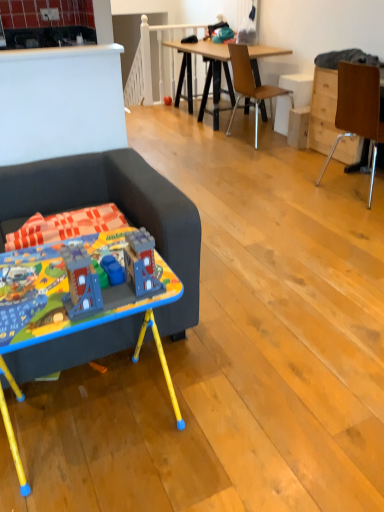
You are a GUI agent. You are given a task and a screenshot of the screen. Output one action in this format:
    pyautogui.click(x=<x>, y=<y>)
    Task: Click on the vacant region to the right of blue plastic desk at lower left
    
    Given the screenshot: What is the action you would take?
    pyautogui.click(x=218, y=409)